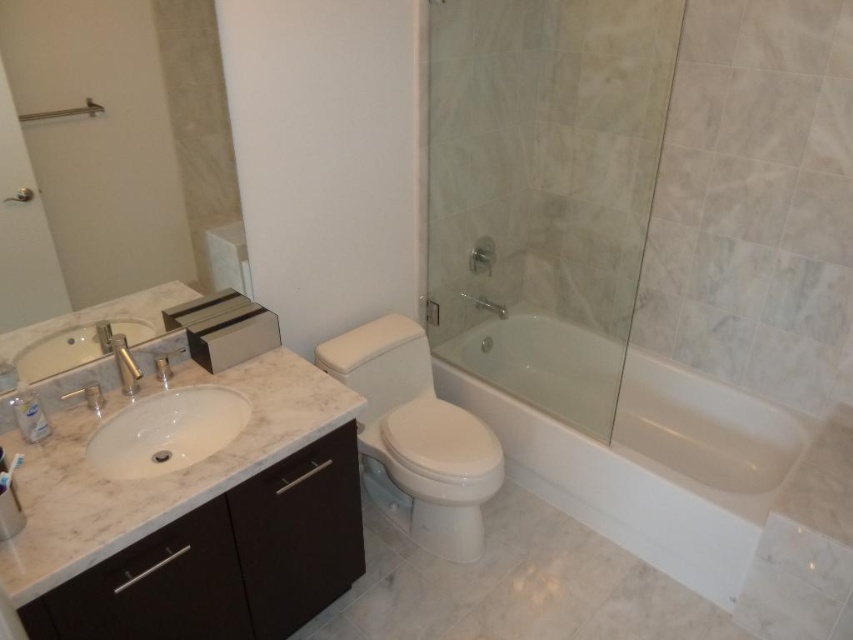
Who is lower down, marble sink at left or white marble sink at lower left?

white marble sink at lower left

You are a GUI agent. You are given a task and a screenshot of the screen. Output one action in this format:
    pyautogui.click(x=<x>, y=<y>)
    Task: Click on the marble sink at left
    This screenshot has height=640, width=853.
    Given the screenshot: What is the action you would take?
    pyautogui.click(x=154, y=476)

Which is behind, point (126, 380) or point (57, 113)?

The point (126, 380) is more distant.

Measure the distance between matte silver faucet at left and camera.

A distance of 5.51 feet exists between matte silver faucet at left and camera.

You are a GUI agent. You are given a task and a screenshot of the screen. Output one action in this format:
    pyautogui.click(x=<x>, y=<y>)
    Task: Click on the matte silver faucet at left
    Image resolution: width=853 pixels, height=640 pixels.
    Given the screenshot: What is the action you would take?
    pyautogui.click(x=125, y=364)

Between point (604, 340) and point (444, 493), which one is positioned in front?

Positioned in front is point (444, 493).

Between point (664, 560) and point (318, 349), which one is positioned behind?

Point (318, 349)

You are a GUI agent. You are given a task and a screenshot of the screen. Output one action in this format:
    pyautogui.click(x=<x>, y=<y>)
    Task: Click on the white glossy bathtub at center
    The image size is (853, 640).
    Given the screenshot: What is the action you would take?
    pyautogui.click(x=633, y=445)